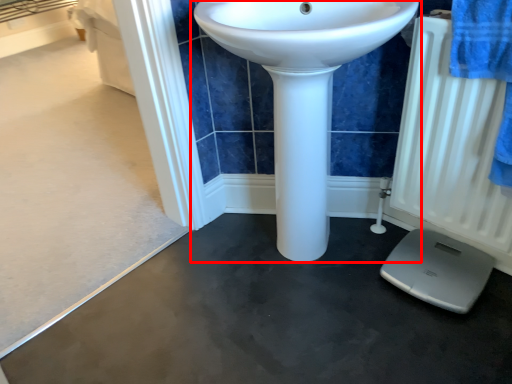
Question: From the image's perspective, what is the correct spatial relationship of sink (annotated by the red box) in relation to radiator?

Choices:
 (A) below
 (B) above

Answer: (B)